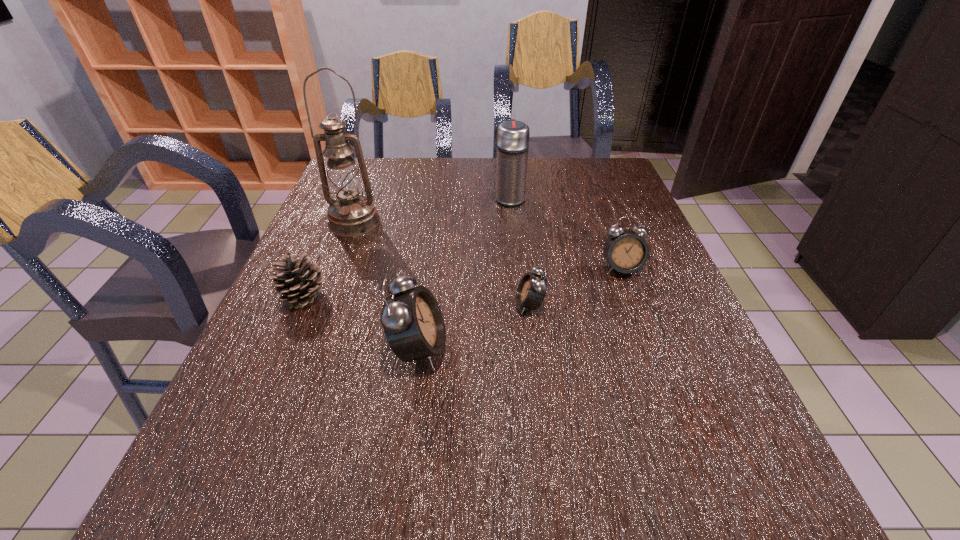
Find the location of a particular element. free space for a new alarm clock on the left is located at coordinates (281, 404).